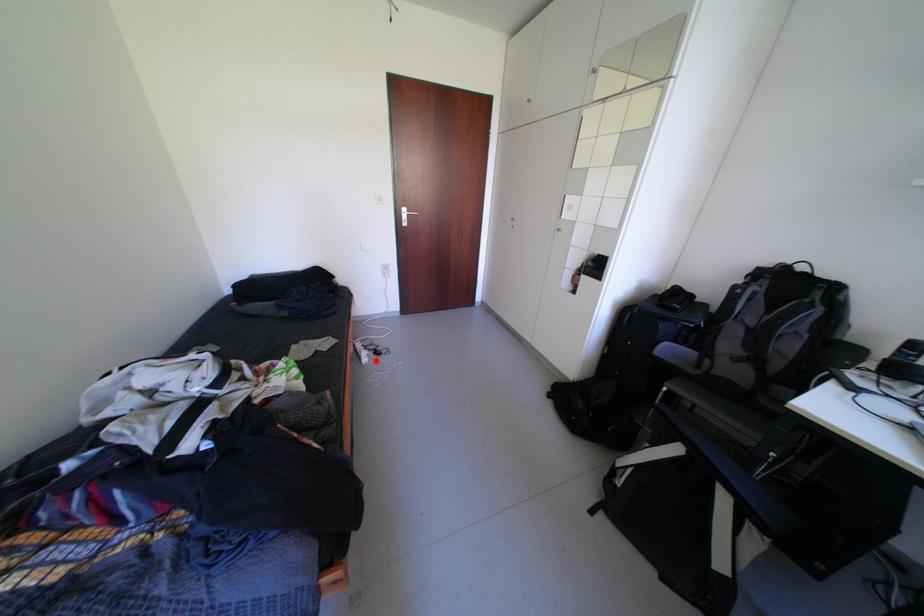
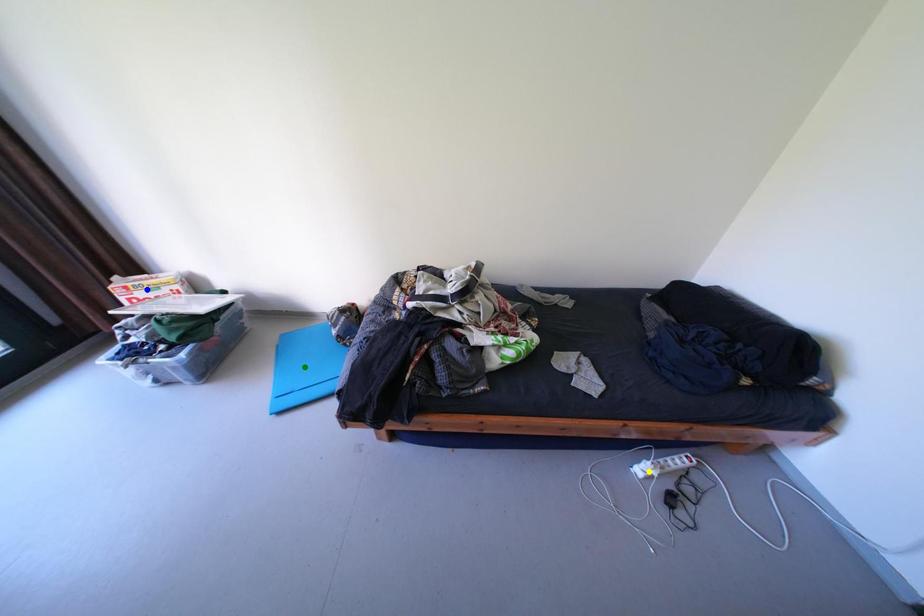
Question: I am providing you with two images of the same scene from different viewpoints. A red point is marked on the first image. You are given multiple points on the second image. Which point in image 2 represents the same 3d spot as the red point in image 1?

Choices:
 (A) green point
 (B) blue point
 (C) yellow point

Answer: (C)